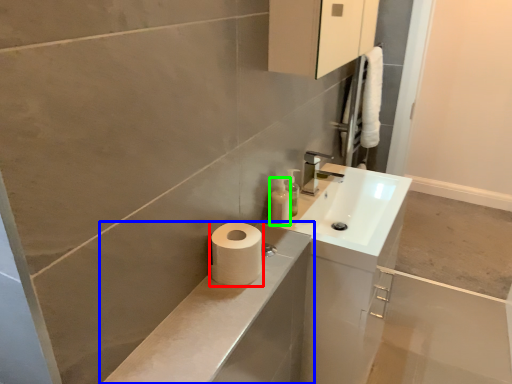
Question: Considering the real-world distances, which object is farthest from toilet paper (highlighted by a red box)? bathroom cabinet (highlighted by a blue box) or toiletry (highlighted by a green box)?

Choices:
 (A) bathroom cabinet
 (B) toiletry

Answer: (B)